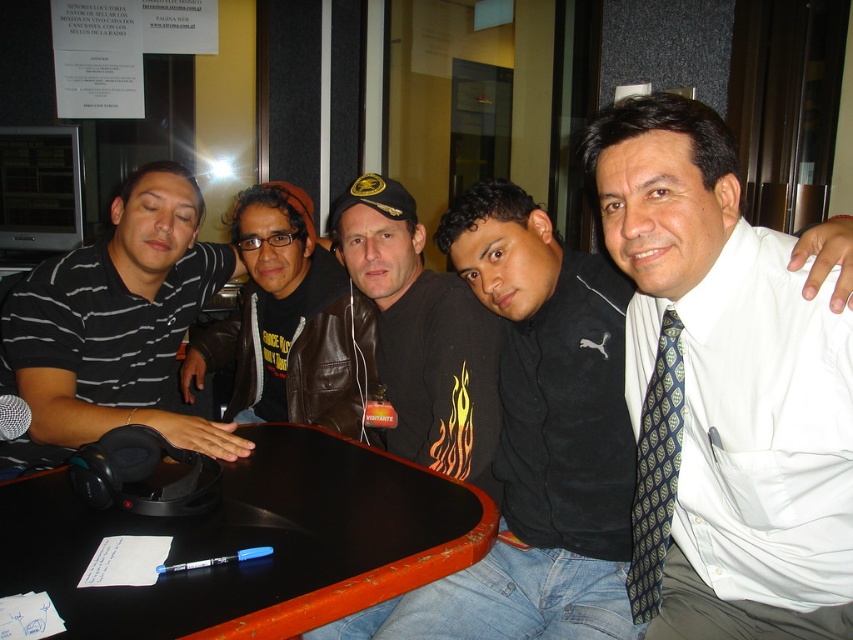
You are a fashion designer observing the image. You need to determine which garment has a more slender appearance between the white silk shirt at upper right and the black leather jacket at center. Which one is it?

The white silk shirt at upper right is thinner than the black leather jacket at center, so the white silk shirt at upper right has a more slender appearance.

You are organizing a photoshoot and need to ensure that the clothing items in the image are arranged by size. Which clothing item from the white silk shirt at upper right and black striped polo shirt at left should be placed first in the order from smallest to largest?

The white silk shirt at upper right should be placed first since it has a smaller width compared to the black striped polo shirt at left.